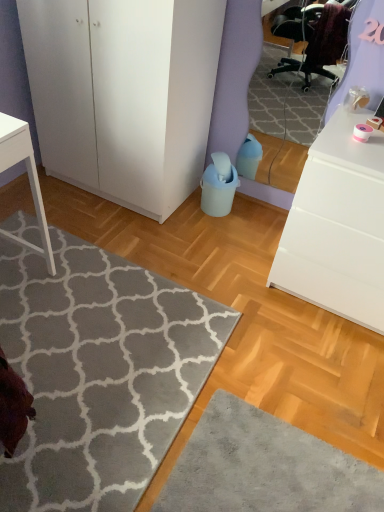
Locate an element on the screen. The image size is (384, 512). vacant space in between white matte chest of drawers at right and gray soft rug at lower left is located at coordinates click(246, 327).